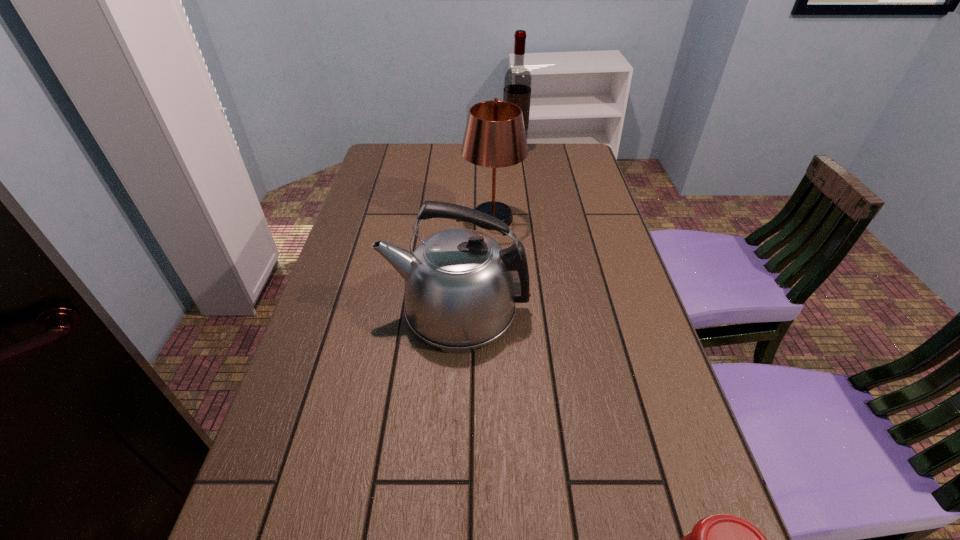
Image resolution: width=960 pixels, height=540 pixels. Find the location of `blank space located on the spout of the kettle`. blank space located on the spout of the kettle is located at coordinates (348, 309).

The image size is (960, 540). What are the coordinates of `object that is positioned at the far edge` in the screenshot? It's located at (518, 80).

Locate an element on the screen. free space at the far edge of the desktop is located at coordinates (434, 166).

Find the location of a particular element. This screenshot has width=960, height=540. blank area at the left edge is located at coordinates (374, 238).

Find the location of a particular element. The height and width of the screenshot is (540, 960). vacant space at the right edge of the desktop is located at coordinates (585, 213).

Locate an element on the screen. free region at the far right corner of the desktop is located at coordinates (567, 175).

The image size is (960, 540). What are the coordinates of `blank region between the farthest object and the kettle` in the screenshot? It's located at (486, 230).

Locate an element on the screen. The height and width of the screenshot is (540, 960). free space between the second shortest object and the farthest object is located at coordinates (486, 230).

At what (x,y) coordinates should I click in order to perform the action: click on unoccupied area between the lampshade and the farthest object. Please return your answer as a coordinate pair (x, y). The width and height of the screenshot is (960, 540). Looking at the image, I should click on [x=502, y=184].

Choose which object is the second nearest neighbor to the condiment. Please provide its 2D coordinates. Your answer should be formatted as a tuple, i.e. [(x, y)], where the tuple contains the x and y coordinates of a point satisfying the conditions above.

[(495, 137)]